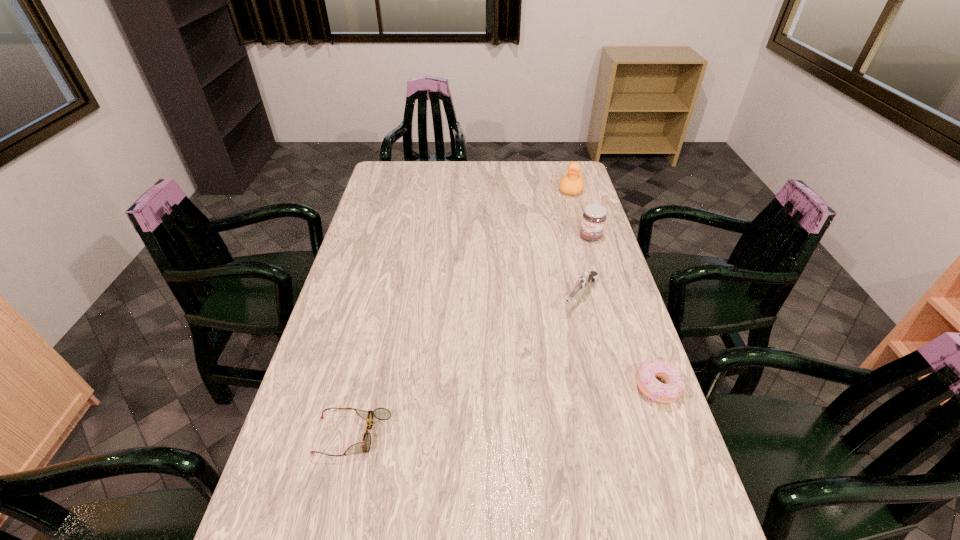
At what (x,y) coordinates should I click in order to perform the action: click on vacant space at the near left corner. Please return your answer as a coordinate pair (x, y). The image size is (960, 540). Looking at the image, I should click on (290, 510).

Identify the location of vacant area between the second nearest object and the third nearest object. (619, 341).

You are a GUI agent. You are given a task and a screenshot of the screen. Output one action in this format:
    pyautogui.click(x=<x>, y=<y>)
    Task: Click on the free area in between the jam and the nearest object
    Image resolution: width=960 pixels, height=540 pixels.
    Given the screenshot: What is the action you would take?
    pyautogui.click(x=472, y=336)

Where is `empty space between the spectacles and the third shortest object`? Image resolution: width=960 pixels, height=540 pixels. empty space between the spectacles and the third shortest object is located at coordinates tap(467, 366).

Find the location of a particular element. The width and height of the screenshot is (960, 540). free space that is in between the spectacles and the second nearest object is located at coordinates (506, 411).

Find the location of a particular element. This screenshot has width=960, height=540. free point between the fourth tallest object and the third tallest object is located at coordinates (619, 341).

In order to click on free space between the gun and the second nearest object in this screenshot , I will do `click(619, 341)`.

The image size is (960, 540). In order to click on free space between the farthest object and the gun in this screenshot , I will do `click(575, 242)`.

You are a GUI agent. You are given a task and a screenshot of the screen. Output one action in this format:
    pyautogui.click(x=<x>, y=<y>)
    Task: Click on the free space between the fourth nearest object and the duck
    The width and height of the screenshot is (960, 540).
    Given the screenshot: What is the action you would take?
    pyautogui.click(x=581, y=213)

This screenshot has height=540, width=960. In order to click on vacant space that's between the duck and the doughnut in this screenshot , I will do `click(614, 288)`.